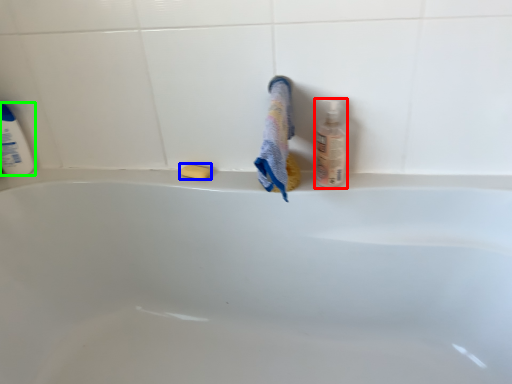
Question: Which is farther away from cleaning product (highlighted by a red box)? soap (highlighted by a blue box) or cleaning product (highlighted by a green box)?

Choices:
 (A) soap
 (B) cleaning product

Answer: (B)